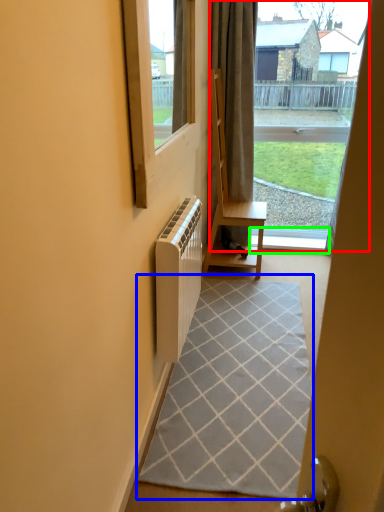
Question: Considering the real-world distances, which object is closest to bay window (highlighted by a red box)? doormat (highlighted by a blue box) or window sill (highlighted by a green box).

Choices:
 (A) doormat
 (B) window sill

Answer: (B)